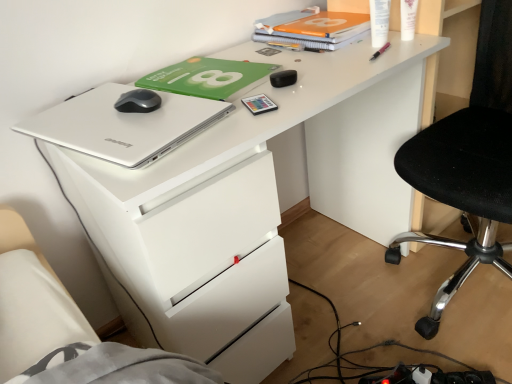
Identify the location of free area behind pink plastic pen at upper right, the 3th stationery positioned from the left. Image resolution: width=512 pixels, height=384 pixels. (355, 43).